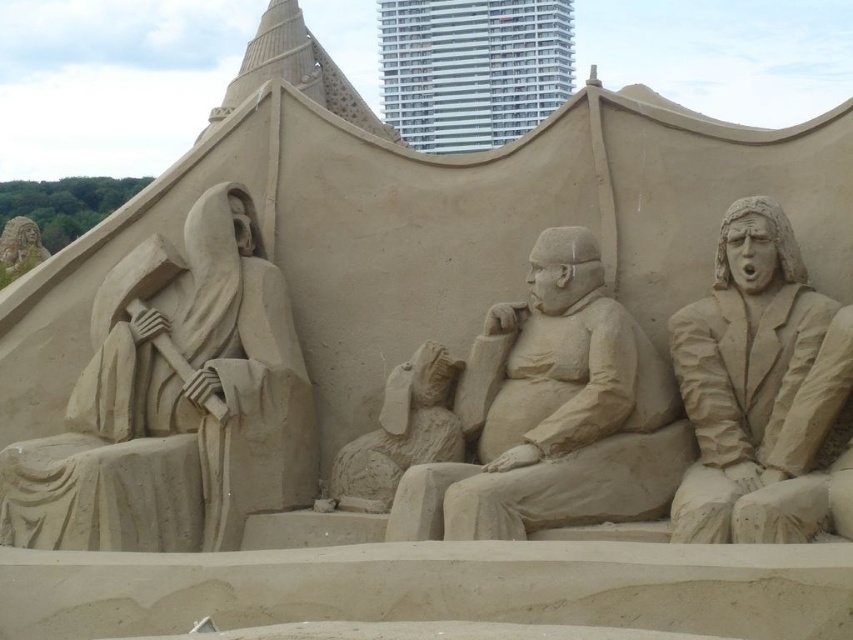
Which is below, smooth sand sculpture at center or smooth sand rabbit at center?

Positioned lower is smooth sand rabbit at center.

Does smooth sand sculpture at center have a lesser width compared to smooth sand rabbit at center?

No.

In order to click on smooth sand sculpture at center in this screenshot , I will do `click(553, 413)`.

You are a GUI agent. You are given a task and a screenshot of the screen. Output one action in this format:
    pyautogui.click(x=<x>, y=<y>)
    Task: Click on the smooth sand sculpture at center
    This screenshot has height=640, width=853.
    Given the screenshot: What is the action you would take?
    pos(553,413)

Can you confirm if smooth sand sculpture at left is smaller than smooth sand sculpture at center?

No, smooth sand sculpture at left is not smaller than smooth sand sculpture at center.

Between smooth sand sculpture at left and smooth sand sculpture at center, which one has less height?

smooth sand sculpture at center

Is point (285, 506) closer to camera compared to point (584, 326)?

No, it is behind (584, 326).

Find the location of a particular element. This screenshot has width=853, height=640. smooth sand sculpture at left is located at coordinates (175, 403).

Is smooth sand sculpture at left in front of smooth sand rabbit at center?

Yes, smooth sand sculpture at left is in front of smooth sand rabbit at center.

Which of these two, smooth sand sculpture at left or smooth sand rabbit at center, stands taller?

smooth sand sculpture at left is taller.

Where is `smooth sand sculpture at left`? The image size is (853, 640). smooth sand sculpture at left is located at coordinates (175, 403).